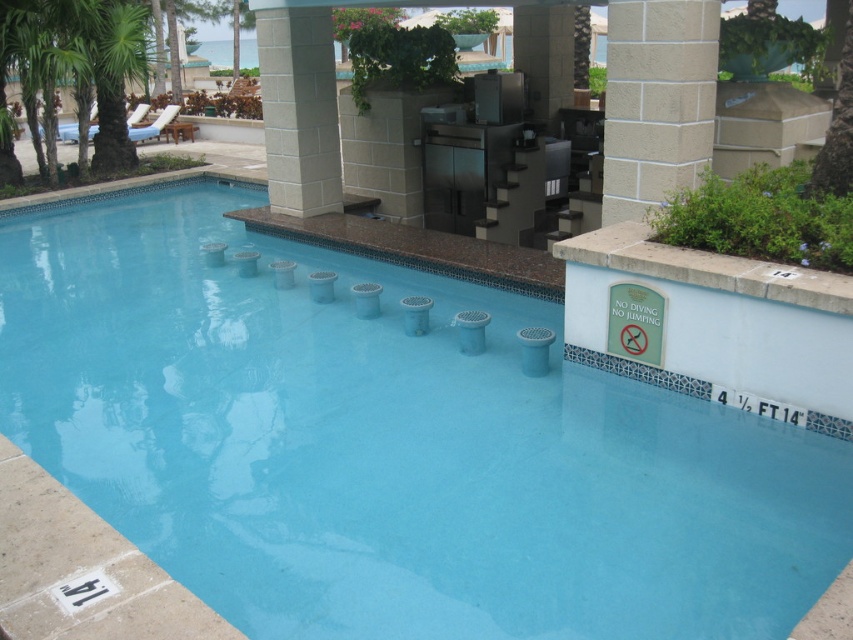
Looking at this image, you are standing at the edge of the pool and want to swim towards the white textured pillar at upper center. Which direction should you swim to reach it from the clear blue water at center?

You should swim to the right from the clear blue water at center because it is located to the left of the white textured pillar at upper center.